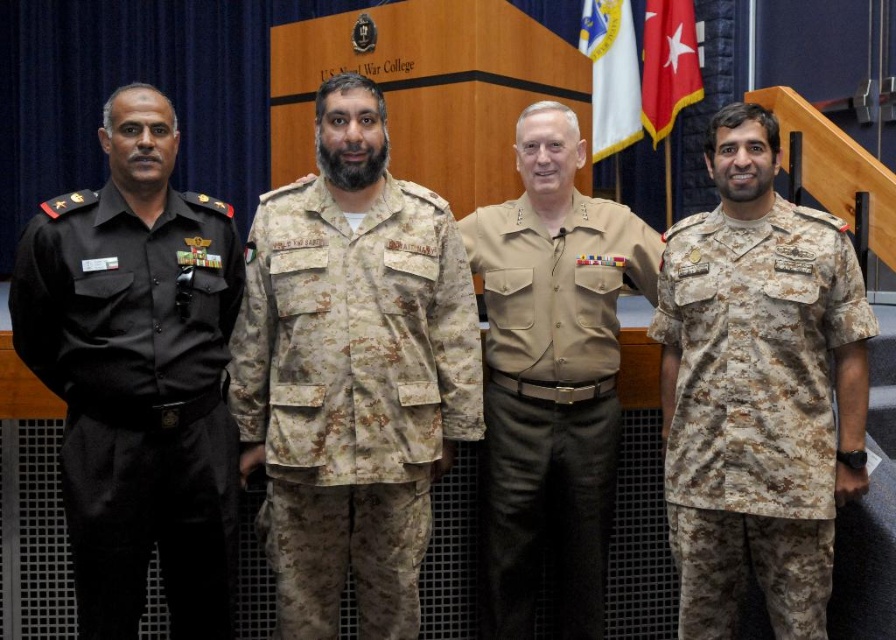
Question: Among these points, which one is nearest to the camera?

Choices:
 (A) (170, 109)
 (B) (479, 364)
 (C) (815, 323)
 (D) (610, 129)

Answer: (A)

Question: Is black uniform at left positioned before camouflage fabric uniform at center?

Choices:
 (A) no
 (B) yes

Answer: (B)

Question: Among these objects, which one is nearest to the camera?

Choices:
 (A) white fabric flag at upper center
 (B) black uniform at left
 (C) camouflage fabric uniform at center

Answer: (B)

Question: Which of these objects is positioned closest to the camouflage fabric uniform at center?

Choices:
 (A) camouflage fabric uniform at right
 (B) white fabric flag at upper center

Answer: (A)

Question: Does tan uniform at center have a larger size compared to white fabric flag at upper center?

Choices:
 (A) no
 (B) yes

Answer: (B)

Question: Can you confirm if black uniform at left is bigger than camouflage fabric uniform at right?

Choices:
 (A) yes
 (B) no

Answer: (B)